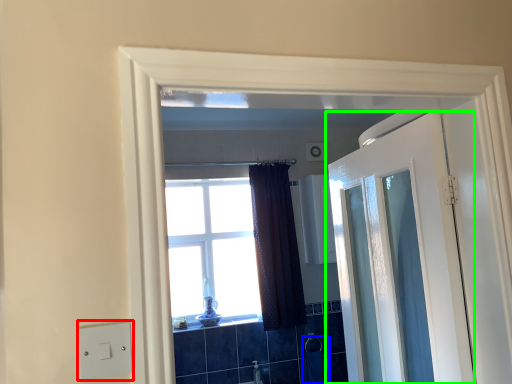
Question: Which object is the farthest from light switch (highlighted by a red box)? Choose among these: laundry (highlighted by a blue box) or door (highlighted by a green box).

Choices:
 (A) laundry
 (B) door

Answer: (A)